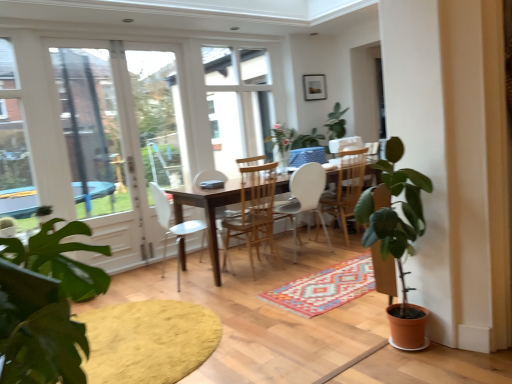
Find the location of a particular element. The height and width of the screenshot is (384, 512). free spot in front of multicolored woven rug at center is located at coordinates (x=318, y=330).